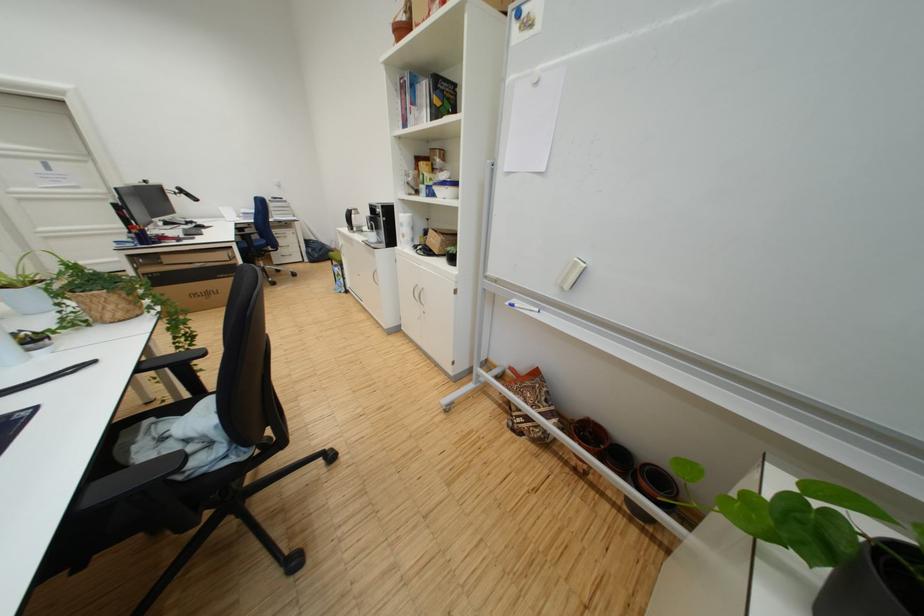
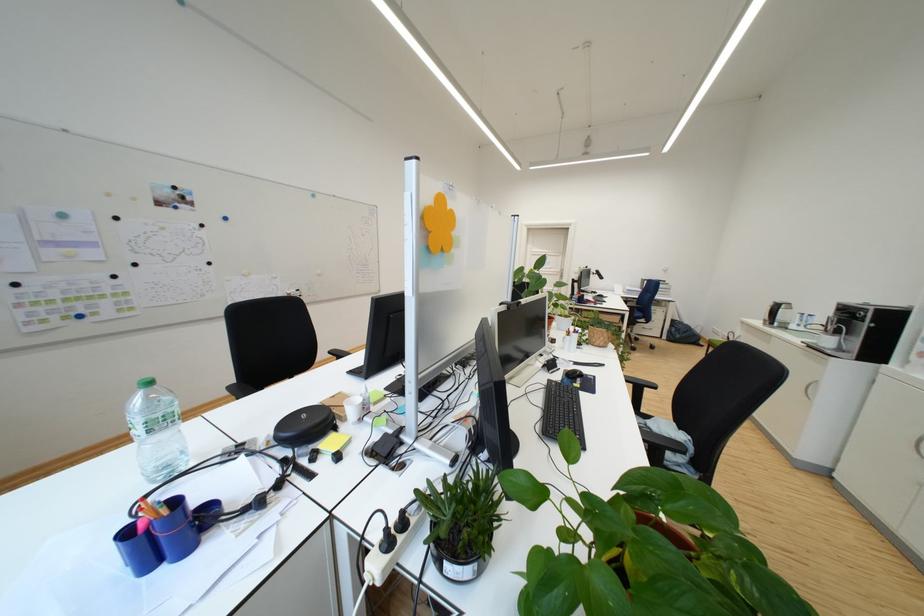
Question: The camera is either moving clockwise (left) or counter-clockwise (right) around the object. The first image is from the beginning of the video and the second image is from the end. Is the camera moving left or right when shooting the video?

Choices:
 (A) Left
 (B) Right

Answer: (B)